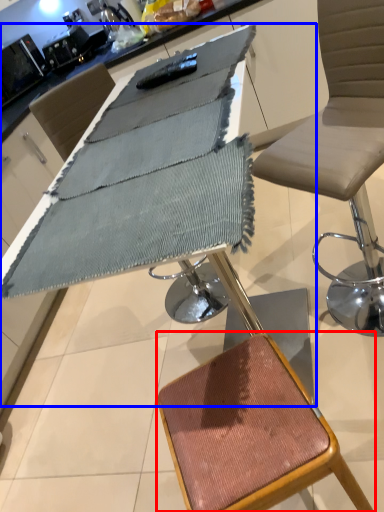
Question: Which object appears farthest to the camera in this image, stool (highlighted by a red box) or table (highlighted by a blue box)?

Choices:
 (A) stool
 (B) table

Answer: (A)